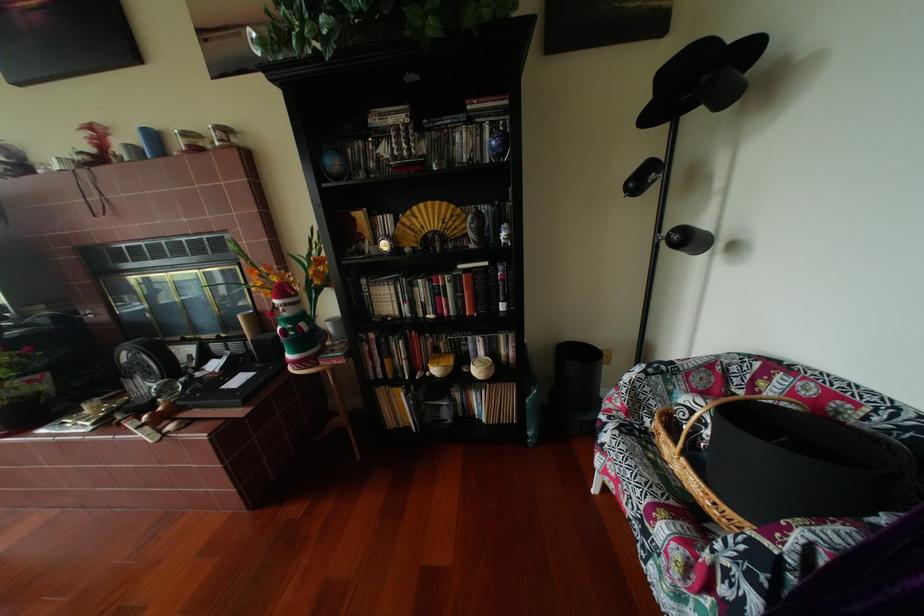
The width and height of the screenshot is (924, 616). In order to click on white remote control in this screenshot , I will do `click(140, 429)`.